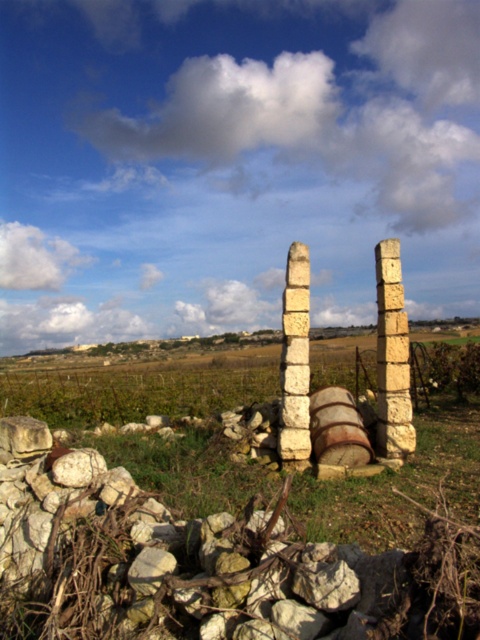
You are standing at the origin point of the coordinate system. You want to place a new stone pillar exactly 0.2 units to the right of the light beige stone pillar at right. What are the coordinates of the new stone pillar?

The light beige stone pillar at right is at point (392, 355). Moving 0.2 units to the right would add 0.2 to the x coordinate, resulting in new coordinates of (392, 483).

From the picture: You are a farmer walking from the vineyard towards the scattered stones in the foreground. Which pillar will you see first as you approach the stones? The light beige stone pillar at right or the white stone pillar at center?

The white stone pillar at center will be seen first because the light beige stone pillar at right is positioned to its right side, meaning the white stone pillar at center is closer along your path towards the stones.